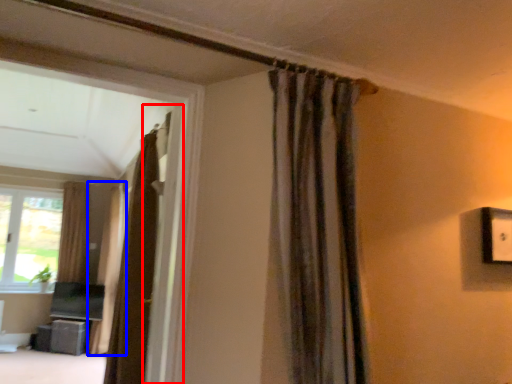
Question: Which point is closer to the camera, screen door (highlighted by a red box) or curtain (highlighted by a blue box)?

Choices:
 (A) screen door
 (B) curtain

Answer: (A)